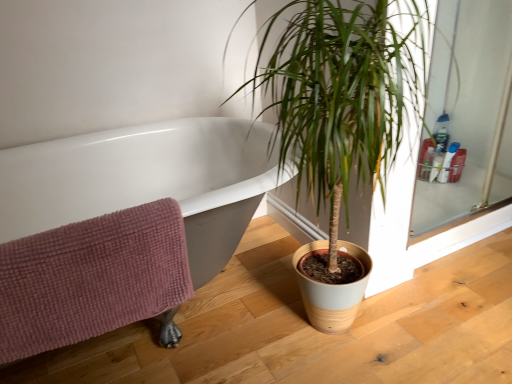
You are a GUI agent. You are given a task and a screenshot of the screen. Output one action in this format:
    pyautogui.click(x=<x>, y=<y>)
    Task: Click on the blank space above pink waffle-textured towel at lower left (from a real-world perspective)
    
    Given the screenshot: What is the action you would take?
    pyautogui.click(x=80, y=226)